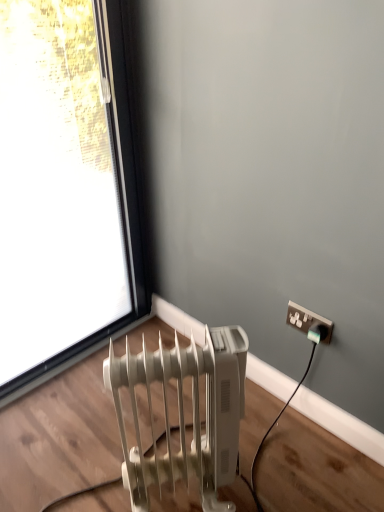
Question: From the image's perspective, would you say white plastic radiator at lower left is shown under transparent glass window at upper left?

Choices:
 (A) yes
 (B) no

Answer: (A)

Question: Is white plastic radiator at lower left thinner than transparent glass window at upper left?

Choices:
 (A) no
 (B) yes

Answer: (A)

Question: Considering the relative sizes of white plastic radiator at lower left and transparent glass window at upper left in the image provided, is white plastic radiator at lower left shorter than transparent glass window at upper left?

Choices:
 (A) no
 (B) yes

Answer: (B)

Question: Can we say white plastic radiator at lower left lies outside transparent glass window at upper left?

Choices:
 (A) no
 (B) yes

Answer: (B)

Question: Is transparent glass window at upper left at the back of white plastic radiator at lower left?

Choices:
 (A) no
 (B) yes

Answer: (B)

Question: Considering the positions of point (115, 245) and point (302, 326), is point (115, 245) closer or farther from the camera than point (302, 326)?

Choices:
 (A) closer
 (B) farther

Answer: (B)

Question: Considering the relative positions of transparent glass window at upper left and white plastic power plugs and sockets at upper right in the image provided, is transparent glass window at upper left to the left or to the right of white plastic power plugs and sockets at upper right?

Choices:
 (A) right
 (B) left

Answer: (B)

Question: From the image's perspective, relative to white plastic power plugs and sockets at upper right, is transparent glass window at upper left above or below?

Choices:
 (A) below
 (B) above

Answer: (B)

Question: Looking at their shapes, would you say transparent glass window at upper left is wider or thinner than white plastic power plugs and sockets at upper right?

Choices:
 (A) wide
 (B) thin

Answer: (A)

Question: Relative to transparent glass window at upper left, is white plastic radiator at lower left in front or behind?

Choices:
 (A) behind
 (B) front

Answer: (B)

Question: Looking at the image, does white plastic radiator at lower left seem bigger or smaller compared to transparent glass window at upper left?

Choices:
 (A) big
 (B) small

Answer: (B)

Question: Is point (226, 403) positioned closer to the camera than point (31, 267)?

Choices:
 (A) closer
 (B) farther

Answer: (A)

Question: From the image's perspective, relative to transparent glass window at upper left, is white plastic radiator at lower left above or below?

Choices:
 (A) below
 (B) above

Answer: (A)

Question: Considering the positions of white plastic power plugs and sockets at upper right and transparent glass window at upper left in the image, is white plastic power plugs and sockets at upper right wider or thinner than transparent glass window at upper left?

Choices:
 (A) thin
 (B) wide

Answer: (A)

Question: Do you think white plastic power plugs and sockets at upper right is within transparent glass window at upper left, or outside of it?

Choices:
 (A) inside
 (B) outside

Answer: (B)